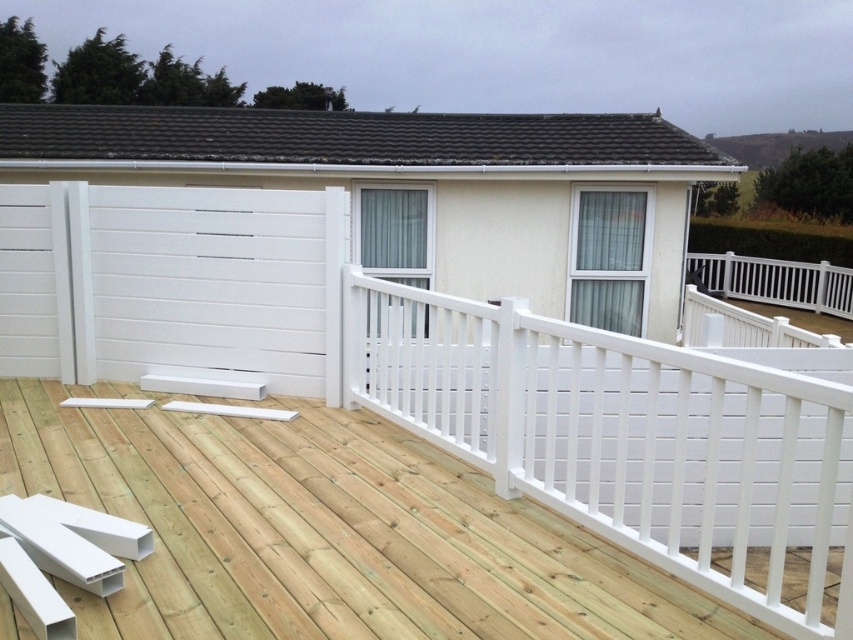
Who is positioned more to the left, natural wood deck at center or white painted wood rail at upper center?

natural wood deck at center is more to the left.

Can you confirm if natural wood deck at center is bigger than white painted wood rail at upper center?

No, natural wood deck at center is not bigger than white painted wood rail at upper center.

The width and height of the screenshot is (853, 640). I want to click on natural wood deck at center, so click(326, 532).